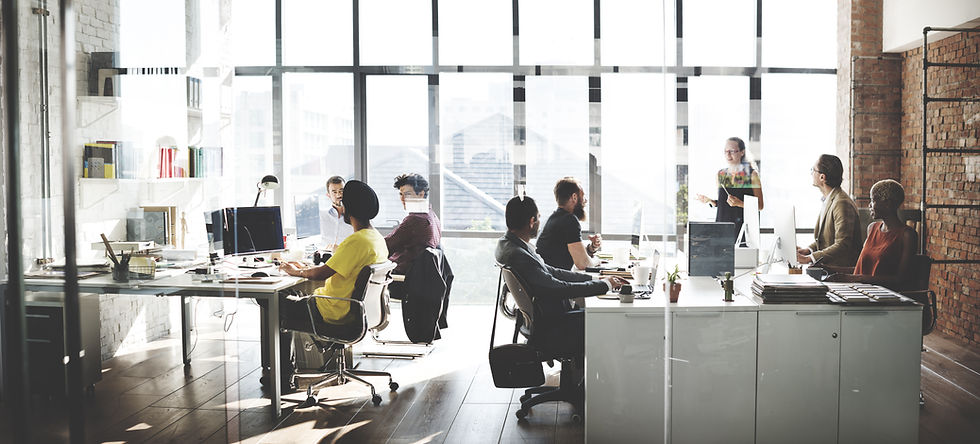
Where is `wheels on computer chair`? wheels on computer chair is located at coordinates (311, 396), (379, 399), (390, 383), (517, 415), (524, 397), (578, 417), (921, 402).